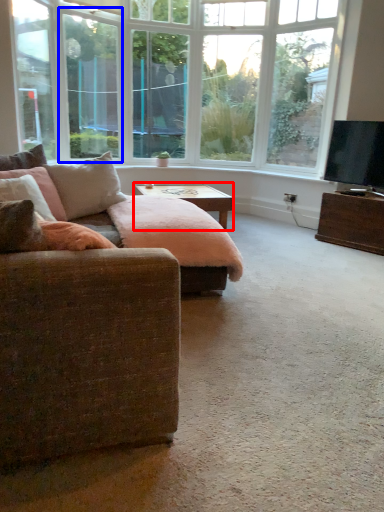
Question: Which point is further to the camera, table (highlighted by a red box) or window screen (highlighted by a blue box)?

Choices:
 (A) table
 (B) window screen

Answer: (B)